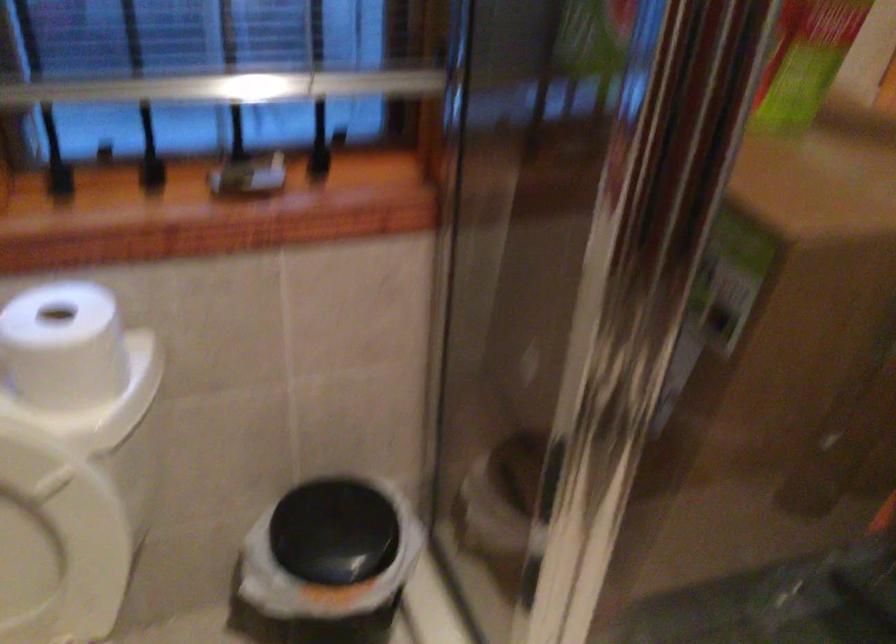
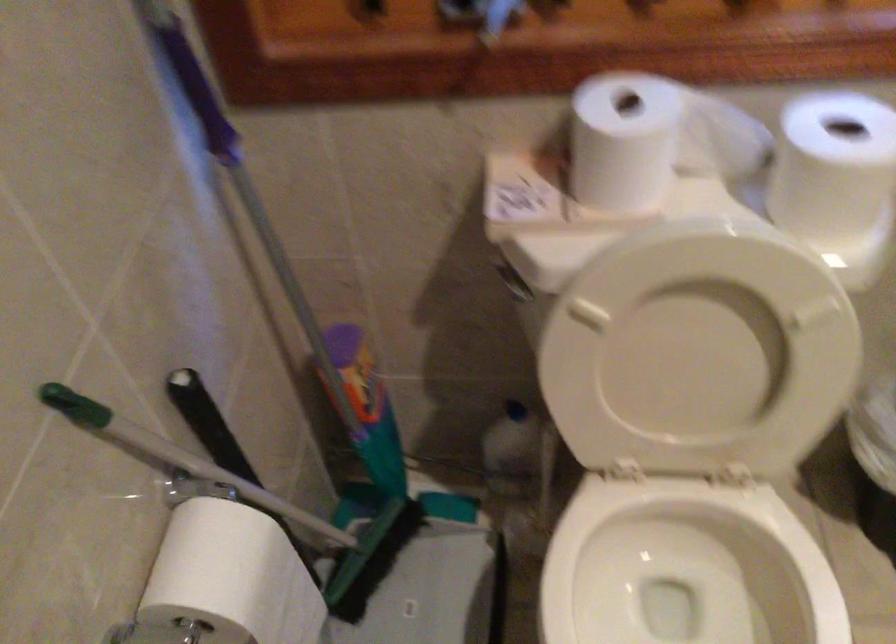
Question: The images are taken continuously from a first-person perspective. In which direction is your viewpoint rotating?

Choices:
 (A) Left
 (B) Right
 (C) Up
 (D) Down

Answer: (A)